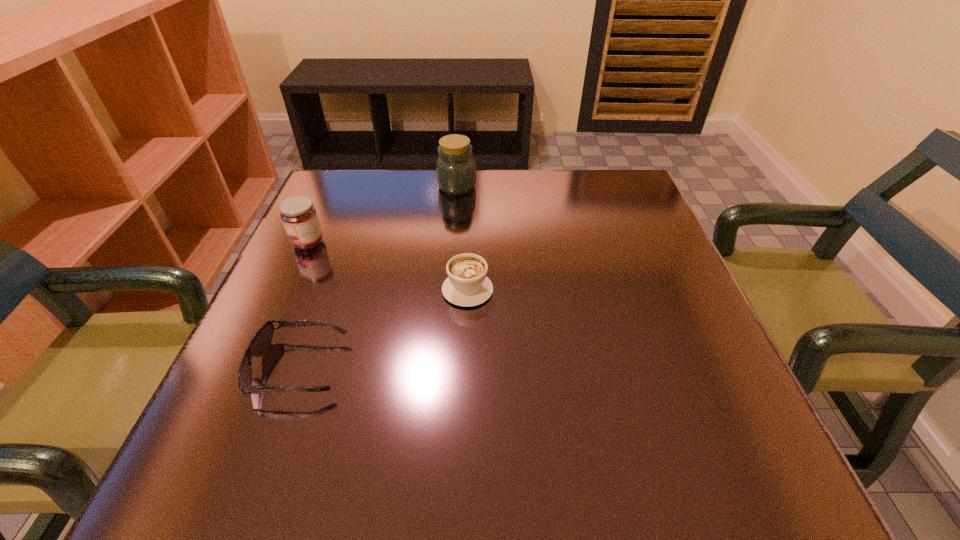
The height and width of the screenshot is (540, 960). In order to click on jar in this screenshot , I will do `click(456, 170)`.

Where is `the tallest object`? the tallest object is located at coordinates (456, 170).

You are a GUI agent. You are given a task and a screenshot of the screen. Output one action in this format:
    pyautogui.click(x=<x>, y=<y>)
    Task: Click on the second farthest object
    The height and width of the screenshot is (540, 960).
    Given the screenshot: What is the action you would take?
    pyautogui.click(x=299, y=216)

Locate an element on the screen. the second tallest object is located at coordinates (299, 216).

Identify the location of the second shortest object. (467, 285).

At what (x,y) coordinates should I click in order to perform the action: click on the third farthest object. Please return your answer as a coordinate pair (x, y). The width and height of the screenshot is (960, 540). Looking at the image, I should click on (467, 285).

You are a GUI agent. You are given a task and a screenshot of the screen. Output one action in this format:
    pyautogui.click(x=<x>, y=<y>)
    Task: Click on the nearest object
    This screenshot has height=540, width=960.
    Given the screenshot: What is the action you would take?
    pyautogui.click(x=262, y=339)

The width and height of the screenshot is (960, 540). Find the location of `sunglasses`. sunglasses is located at coordinates (262, 339).

Where is `free space located 0.320m on the front of the farthest object`? free space located 0.320m on the front of the farthest object is located at coordinates (449, 287).

The image size is (960, 540). I want to click on free space located 0.110m on the front of the jam, so click(x=287, y=289).